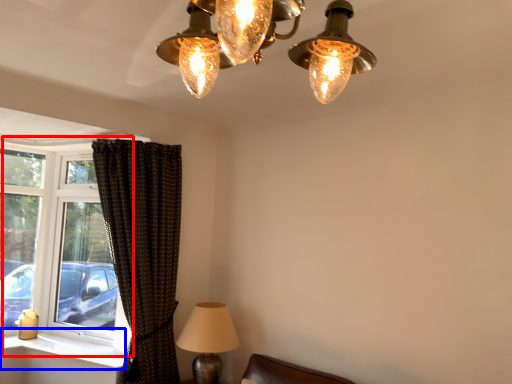
Question: Which object is further to the camera taking this photo, window (highlighted by a red box) or window sill (highlighted by a blue box)?

Choices:
 (A) window
 (B) window sill

Answer: (A)